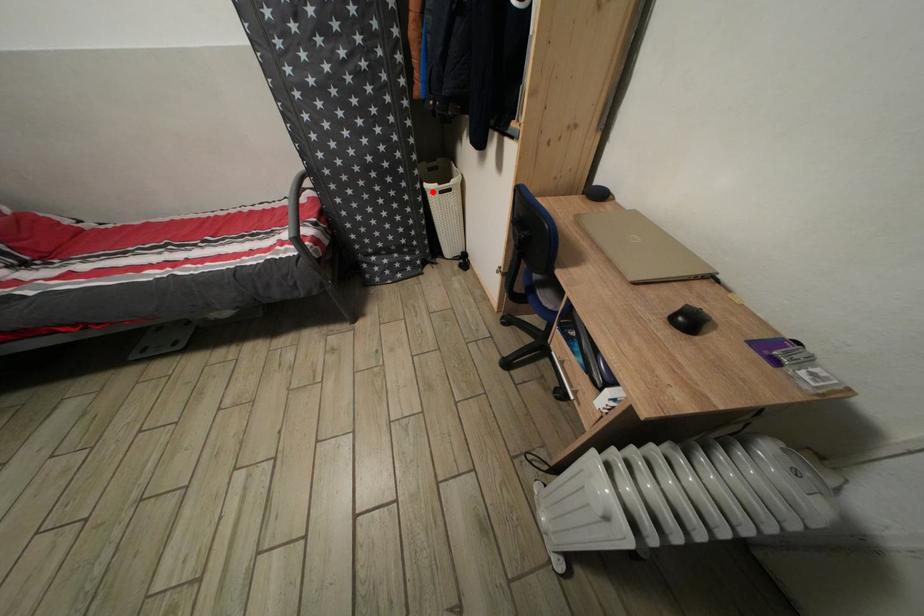
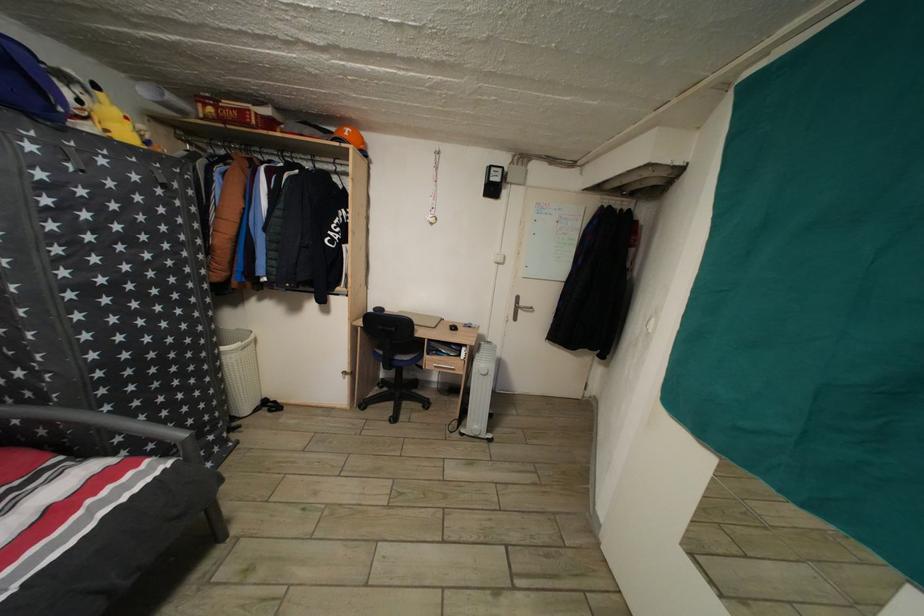
Question: I am providing you with two images of the same scene from different viewpoints. In image1, a red point is highlighted. Considering the same 3D point in image2, which of the following is correct?

Choices:
 (A) It is closer
 (B) It is farther

Answer: (B)